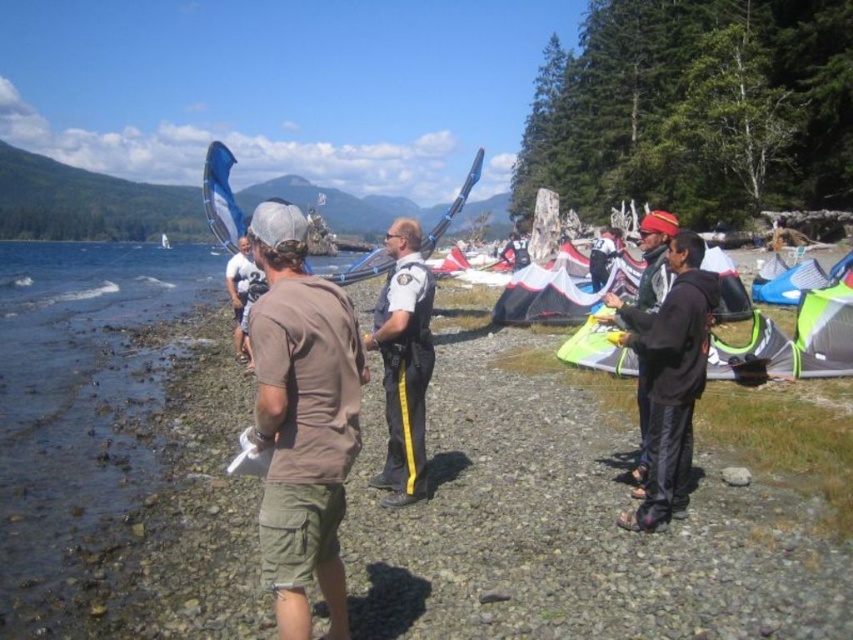
Question: Among these points, which one is nearest to the camera?

Choices:
 (A) (395, 321)
 (B) (793, 278)
 (C) (671, 289)

Answer: (C)

Question: Can you confirm if black matte jacket at right is positioned to the left of blue fabric tent at center right?

Choices:
 (A) no
 (B) yes

Answer: (B)

Question: Which point is closer to the camera?

Choices:
 (A) (758, 292)
 (B) (373, 477)
 (C) (289, 262)
 (D) (633, 349)

Answer: (C)

Question: Does black matte jacket at right appear over black uniform at center?

Choices:
 (A) yes
 (B) no

Answer: (B)

Question: Is black matte jacket at right bigger than blue fabric tent at center right?

Choices:
 (A) yes
 (B) no

Answer: (B)

Question: Estimate the real-world distances between objects in this image. Which object is closer to the black uniform at center?

Choices:
 (A) brown cotton t-shirt at center
 (B) black matte jacket at right
 (C) blue fabric tent at center right

Answer: (A)